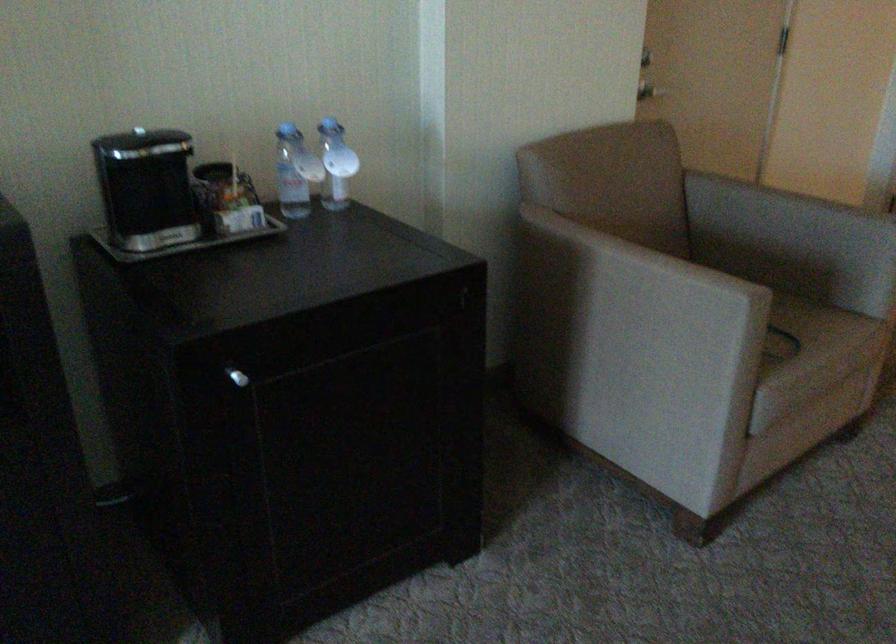
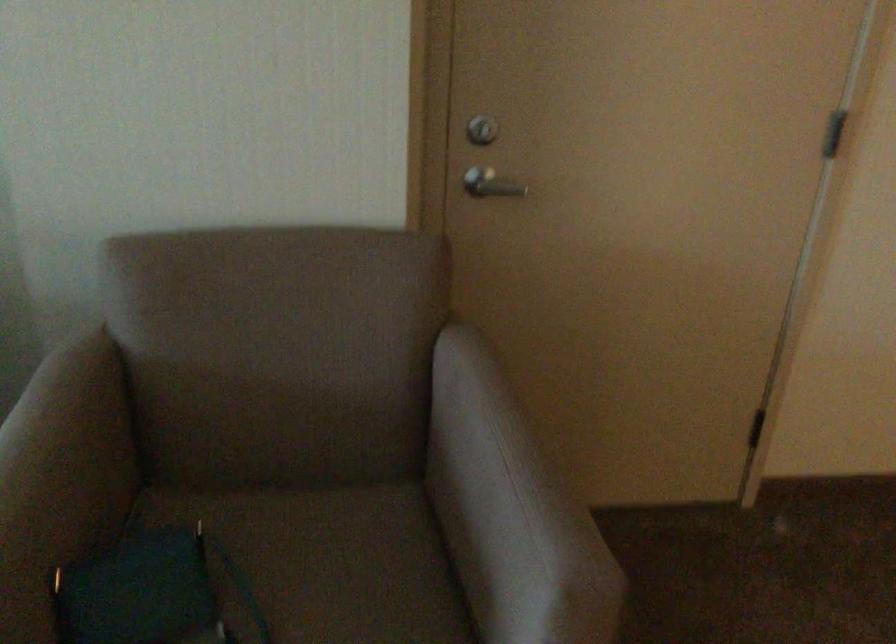
What movement of the cameraman would produce the second image?

The movement direction of the cameraman is right, forward.